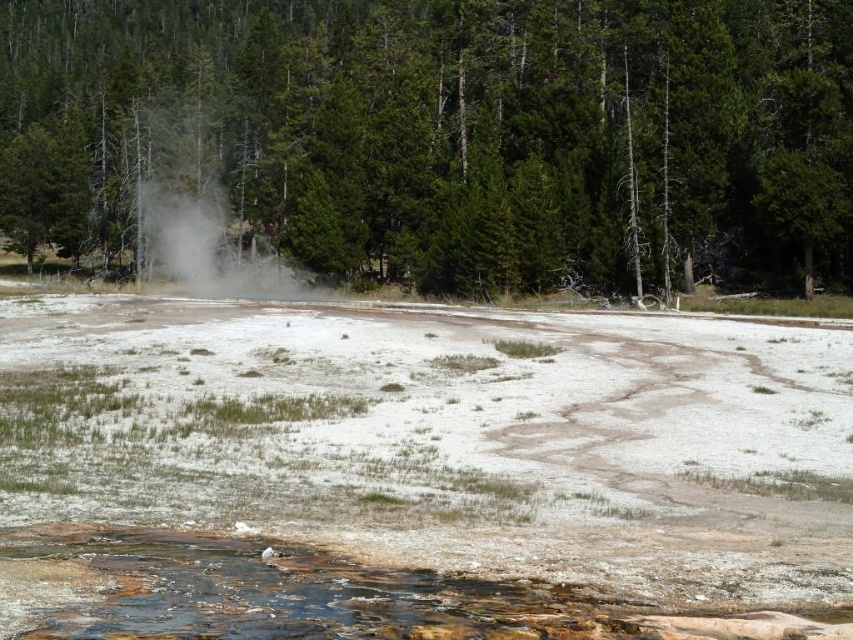
Question: Can you confirm if green textured tree at center is thinner than white vapor at center?

Choices:
 (A) yes
 (B) no

Answer: (B)

Question: Which point appears closest to the camera in this image?

Choices:
 (A) (260, 266)
 (B) (712, 72)

Answer: (B)

Question: Is green textured tree at center above white vapor at center?

Choices:
 (A) yes
 (B) no

Answer: (A)

Question: Which of the following is the farthest from the observer?

Choices:
 (A) white vapor at center
 (B) green textured tree at center

Answer: (A)

Question: Does green textured tree at center appear on the right side of white vapor at center?

Choices:
 (A) no
 (B) yes

Answer: (A)